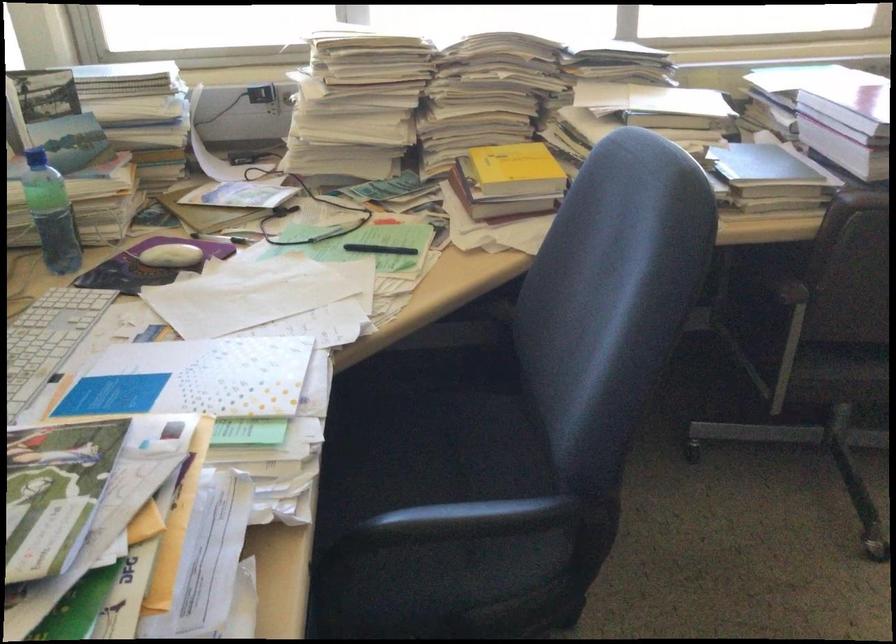
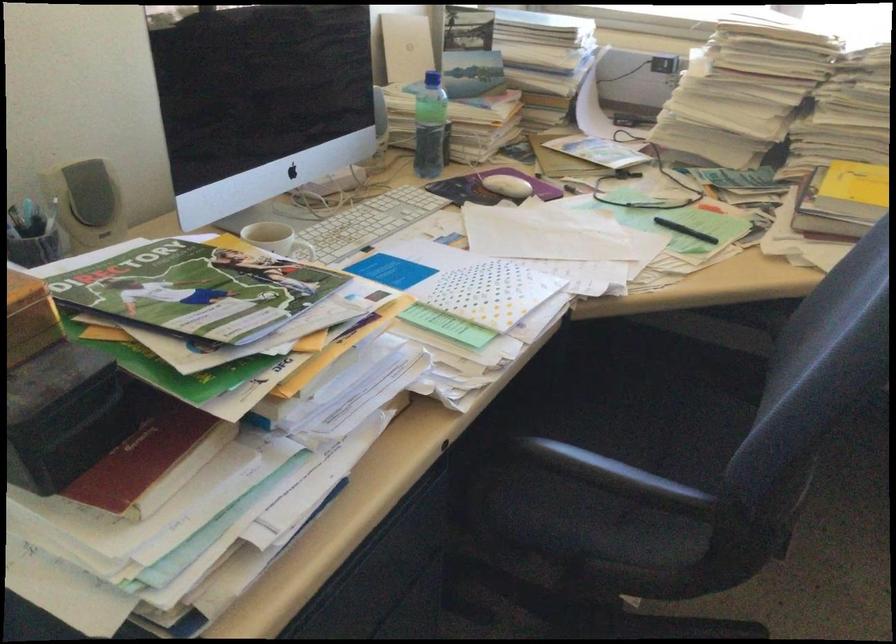
In the second image, find the point that corresponds to pixel 488 520 in the first image.

(614, 474)